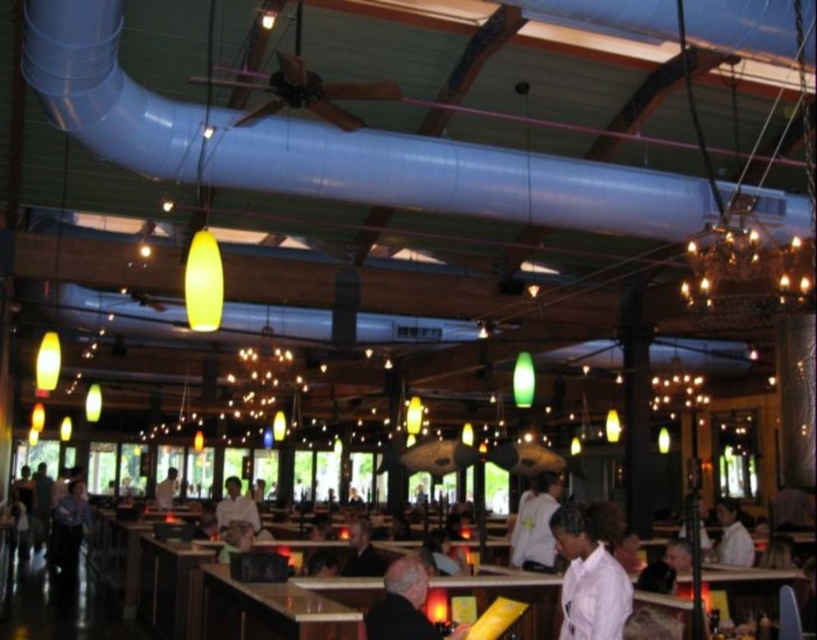
Based on the photo, you are a restaurant server who just noticed two coats hanging on a rack near the entrance. The coats are labeled as the dark gray sweater at center and the dark brown leather jacket at center. Which coat is on the right side when facing the rack?

The dark gray sweater at center is positioned on the right side of the dark brown leather jacket at center, so when facing the rack, the dark gray sweater at center is on the right side.

Consider the image. You are a restaurant server who needs to place a 1.2 meter wide tray between the dark gray sweater at center and the dark brown leather jacket at center. Can you fit the tray between them?

The dark gray sweater at center is wider than the dark brown leather jacket at center, so the total width of both items combined may exceed the available space for the 1.2 meter tray. However, without knowing the exact distance between them, it is uncertain if the tray will fit. Please check the actual spacing between the two items before placing the tray.